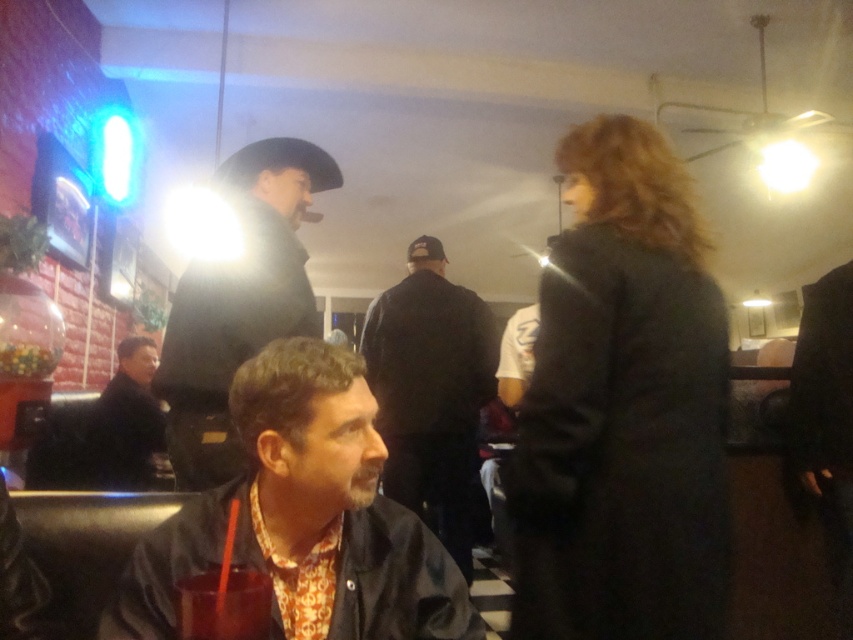
Question: Which of these objects is positioned farthest from the dark brown leather jacket at lower left?

Choices:
 (A) black leather cowboy hat at upper left
 (B) floral shirt at center
 (C) dark blue jacket at center
 (D) translucent glass drink at lower center

Answer: (D)

Question: Based on their relative distances, which object is nearer to the floral shirt at center?

Choices:
 (A) dark brown leather jacket at lower left
 (B) black leather cowboy hat at upper left

Answer: (B)

Question: Does dark blue jacket at center have a lesser width compared to dark brown leather jacket at lower left?

Choices:
 (A) no
 (B) yes

Answer: (A)

Question: Can you confirm if dark gray coat at center is positioned to the right of black leather cowboy hat at upper left?

Choices:
 (A) no
 (B) yes

Answer: (B)

Question: Is floral shirt at center to the right of translucent glass drink at lower center from the viewer's perspective?

Choices:
 (A) no
 (B) yes

Answer: (B)

Question: Which is nearer to the black leather cowboy hat at upper left?

Choices:
 (A) dark gray coat at center
 (B) translucent glass drink at lower center

Answer: (A)